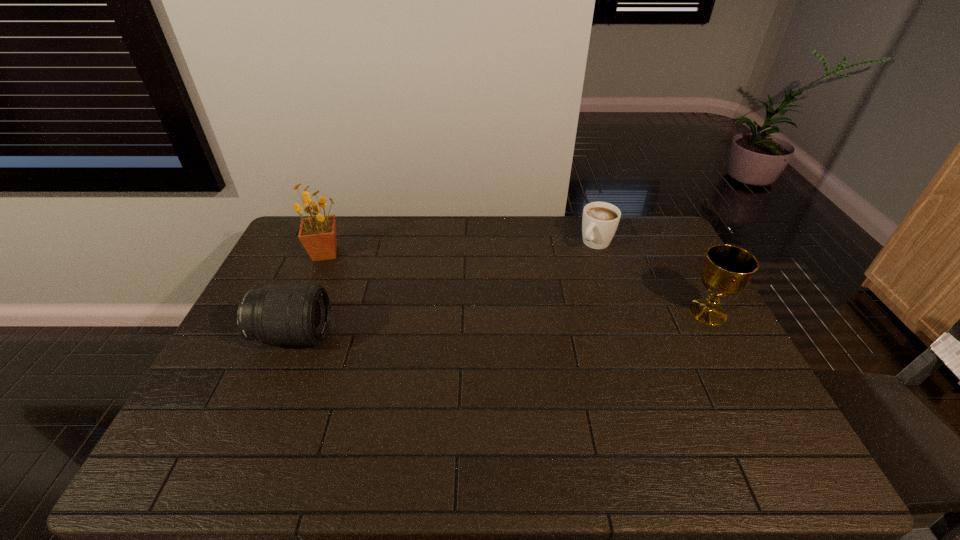
Where is `vacant space on the desktop that is between the telephoto lens and the rightmost object and is positioned with the handle on the side of the shortest object`? The height and width of the screenshot is (540, 960). vacant space on the desktop that is between the telephoto lens and the rightmost object and is positioned with the handle on the side of the shortest object is located at coordinates (519, 322).

Identify the location of vacant space on the desktop that is between the telephoto lens and the third shortest object and is positioned at the front of the sunflower with flowers visible. This screenshot has width=960, height=540. (470, 325).